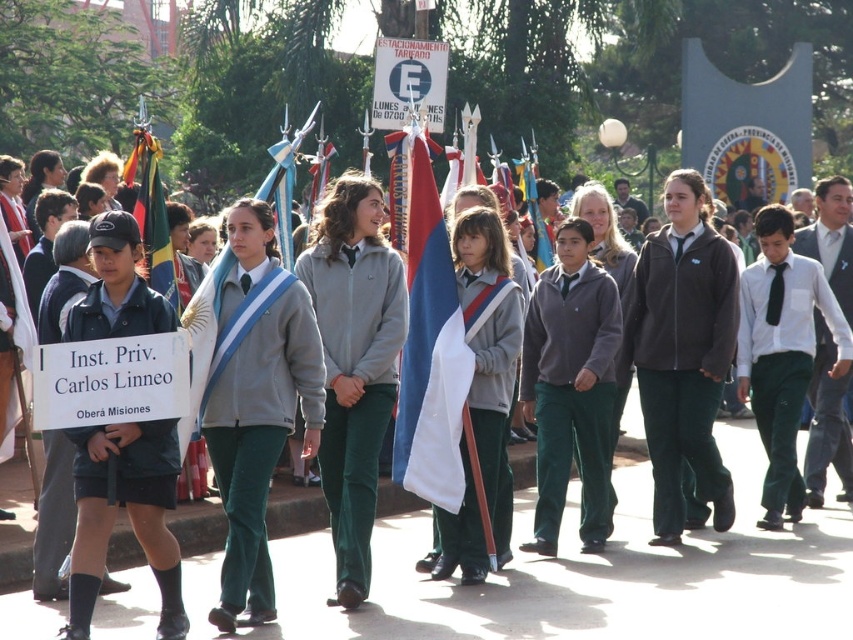
Question: Is white fabric flag at center to the right of green fabric sash at center from the viewer's perspective?

Choices:
 (A) yes
 (B) no

Answer: (A)

Question: Is dark blue uniform at center to the left of dark gray fleece jacket at center from the viewer's perspective?

Choices:
 (A) yes
 (B) no

Answer: (A)

Question: Which of the following is the farthest from the observer?

Choices:
 (A) white fabric tie at center
 (B) green fabric pants at center
 (C) blue and white fabric flag at center

Answer: (C)

Question: Is velvet green pants at center wider than white fabric sash at center?

Choices:
 (A) yes
 (B) no

Answer: (A)

Question: Which point is farther from the camera taking this photo?

Choices:
 (A) (163, 500)
 (B) (833, 384)
 (C) (438, 397)
 (D) (709, 344)

Answer: (B)

Question: Which object is farther from the camera taking this photo?

Choices:
 (A) velvet green pants at center
 (B) white cotton shirt at center
 (C) dark blue uniform at center

Answer: (B)